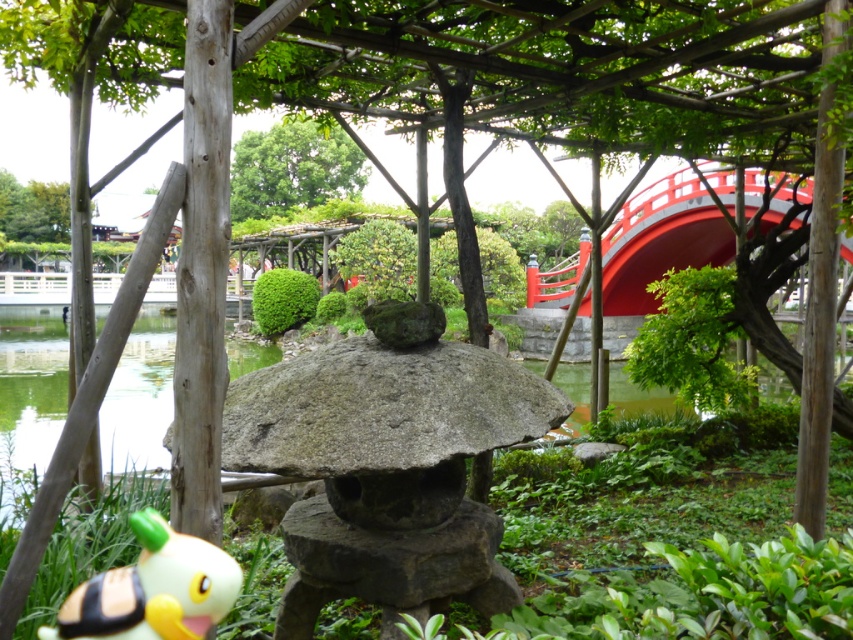
Can you confirm if gray stone lantern at center is positioned to the right of green leafy tree at upper center?

Correct, you'll find gray stone lantern at center to the right of green leafy tree at upper center.

Is gray stone lantern at center shorter than green leafy tree at upper center?

Correct, gray stone lantern at center is not as tall as green leafy tree at upper center.

Is point (466, 570) positioned after point (296, 148)?

No.

Find the location of `gray stone lantern at center`. gray stone lantern at center is located at coordinates (387, 465).

Does gray stone lantern at center have a lesser width compared to green mossy water at lower left?

Yes.

Does gray stone lantern at center appear on the right side of green mossy water at lower left?

Correct, you'll find gray stone lantern at center to the right of green mossy water at lower left.

What do you see at coordinates (387, 465) in the screenshot? I see `gray stone lantern at center` at bounding box center [387, 465].

I want to click on gray stone lantern at center, so click(387, 465).

Is the position of green mossy water at lower left less distant than that of bee plush at lower left?

No, green mossy water at lower left is behind bee plush at lower left.

Can you confirm if green mossy water at lower left is positioned to the right of bee plush at lower left?

In fact, green mossy water at lower left is to the left of bee plush at lower left.

This screenshot has width=853, height=640. What do you see at coordinates (32, 380) in the screenshot?
I see `green mossy water at lower left` at bounding box center [32, 380].

You are a GUI agent. You are given a task and a screenshot of the screen. Output one action in this format:
    pyautogui.click(x=<x>, y=<y>)
    Task: Click on the green mossy water at lower left
    
    Given the screenshot: What is the action you would take?
    pyautogui.click(x=32, y=380)